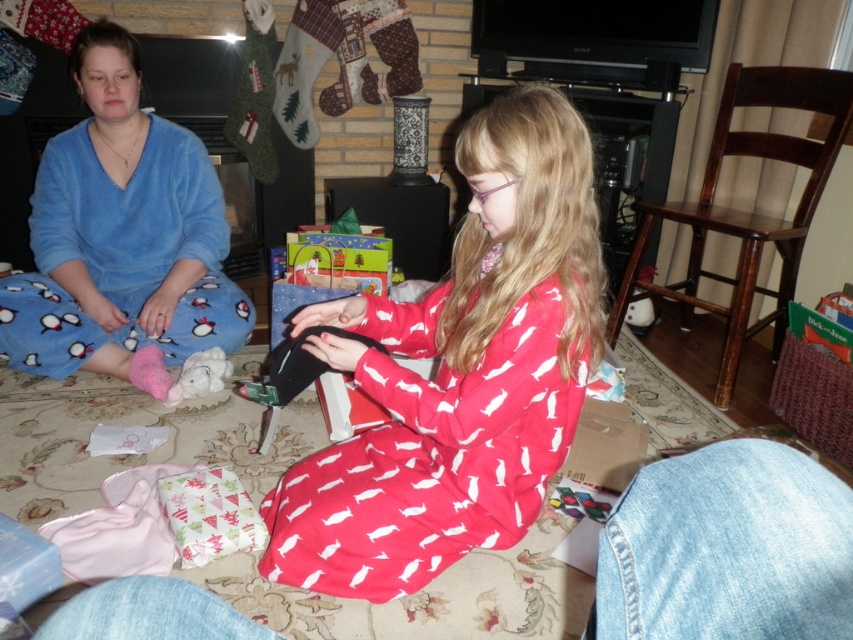
Question: Where is red cotton stocking at lower center located in relation to white plush toy at lower left in the image?

Choices:
 (A) right
 (B) left

Answer: (A)

Question: Which point is closer to the camera taking this photo?

Choices:
 (A) (112, 365)
 (B) (718, 499)

Answer: (B)

Question: Is blue fleece pajamas at left thinner than white plush toy at lower left?

Choices:
 (A) yes
 (B) no

Answer: (B)

Question: Does matte black wallet at center appear over white plush toy at lower left?

Choices:
 (A) yes
 (B) no

Answer: (A)

Question: Which point is farther to the camera?

Choices:
 (A) light blue denim stocking at lower right
 (B) white plush toy at lower left
 (C) blue fleece pajamas at left

Answer: (B)

Question: Which point appears farthest from the camera in this image?

Choices:
 (A) (199, 371)
 (B) (392, 532)
 (C) (136, 307)

Answer: (C)